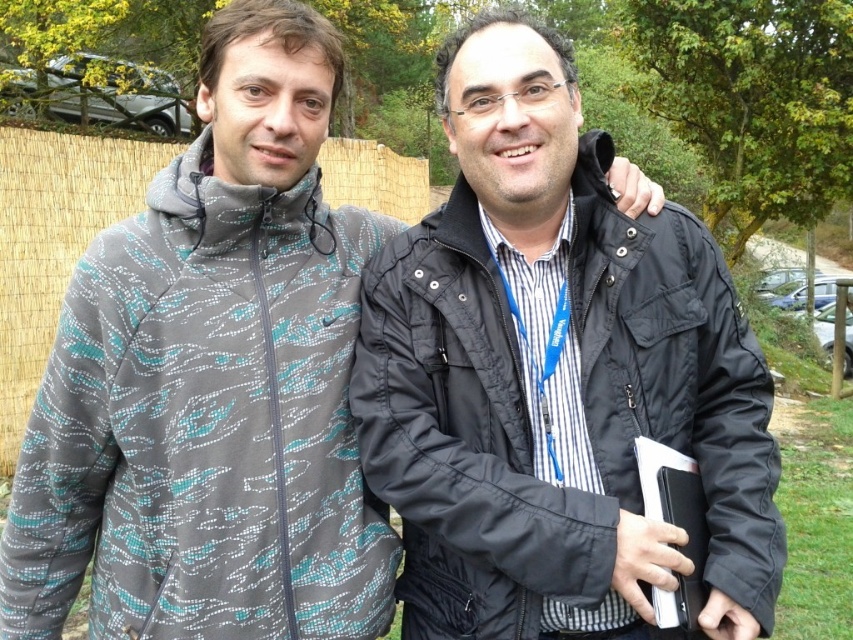
Question: In this image, where is gray printed jacket at left located relative to black quilted jacket at center?

Choices:
 (A) below
 (B) above

Answer: (A)

Question: Which of the following is the farthest from the observer?

Choices:
 (A) (395, 241)
 (B) (315, 564)

Answer: (A)

Question: Which point is closer to the camera taking this photo?

Choices:
 (A) (585, 531)
 (B) (308, 538)

Answer: (A)

Question: From the image, what is the correct spatial relationship of gray printed jacket at left in relation to black quilted jacket at center?

Choices:
 (A) right
 (B) left

Answer: (B)

Question: Can you confirm if gray printed jacket at left is smaller than black quilted jacket at center?

Choices:
 (A) no
 (B) yes

Answer: (A)